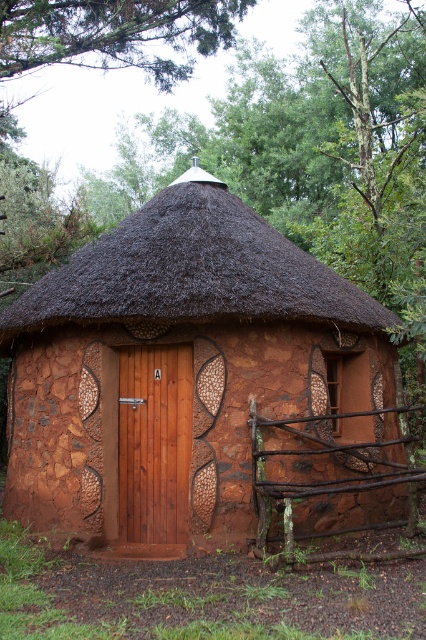
Does terracotta stone hut at center have a lesser width compared to brown wooden fence at lower right?

No, terracotta stone hut at center is not thinner than brown wooden fence at lower right.

Which is behind, point (140, 538) or point (327, 417)?

Point (140, 538)

The image size is (426, 640). Identify the location of terracotta stone hut at center. (195, 381).

Which is below, wooden door at center or brown wooden fence at lower right?

brown wooden fence at lower right is below.

Is wooden door at center behind brown wooden fence at lower right?

Yes, it is.

Does point (154, 435) come closer to viewer compared to point (379, 483)?

No, (154, 435) is behind (379, 483).

Locate an element on the screen. Image resolution: width=426 pixels, height=640 pixels. wooden door at center is located at coordinates (155, 442).

Does terracotta stone hut at center appear over wooden door at center?

Correct, terracotta stone hut at center is located above wooden door at center.

At what (x,y) coordinates should I click in order to perform the action: click on terracotta stone hut at center. Please return your answer as a coordinate pair (x, y). Looking at the image, I should click on (195, 381).

This screenshot has width=426, height=640. I want to click on terracotta stone hut at center, so click(x=195, y=381).